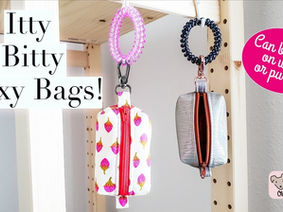
You are a GUI agent. You are given a task and a screenshot of the screen. Output one action in this format:
    pyautogui.click(x=<x>, y=<y>)
    Task: Click on the white wall
    The image size is (283, 212).
    Given the screenshot: What is the action you would take?
    pyautogui.click(x=192, y=201)